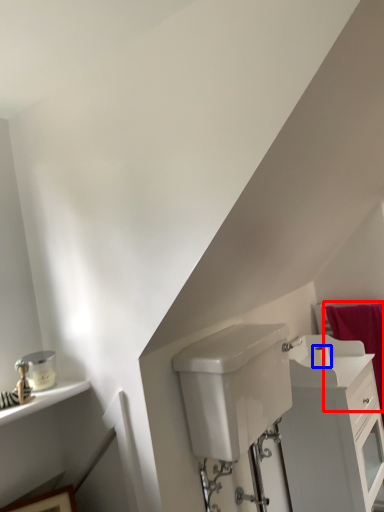
Question: Which of the following is the closest to the observer, bath towel (highlighted by a red box) or toilet paper (highlighted by a blue box)?

Choices:
 (A) bath towel
 (B) toilet paper

Answer: (B)